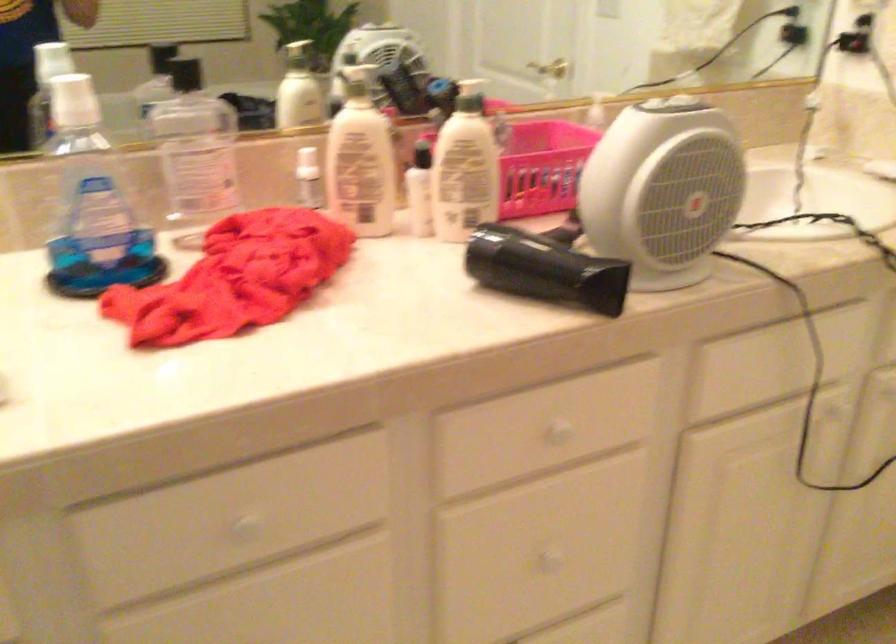
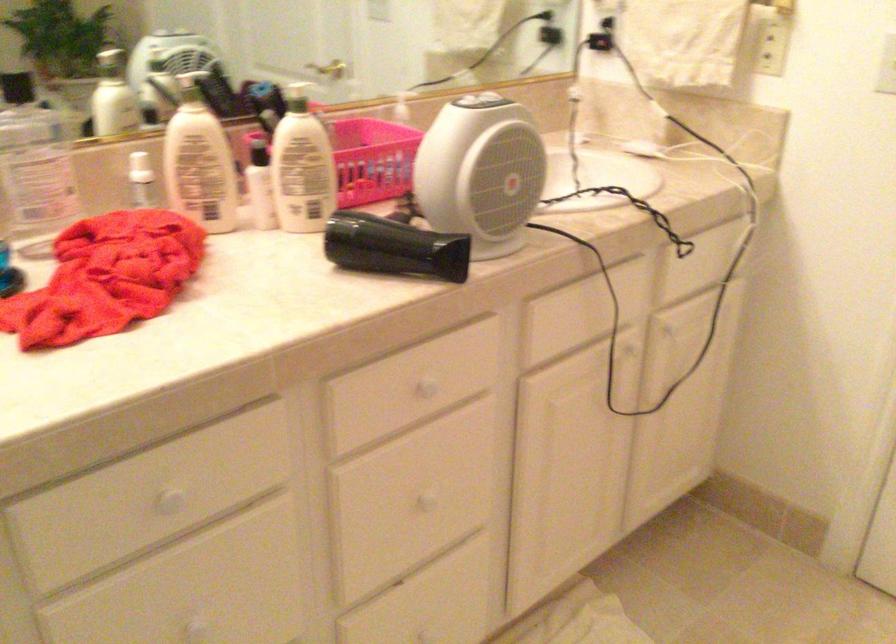
In the second image, find the point that corresponds to pixel 673 106 in the first image.

(484, 102)